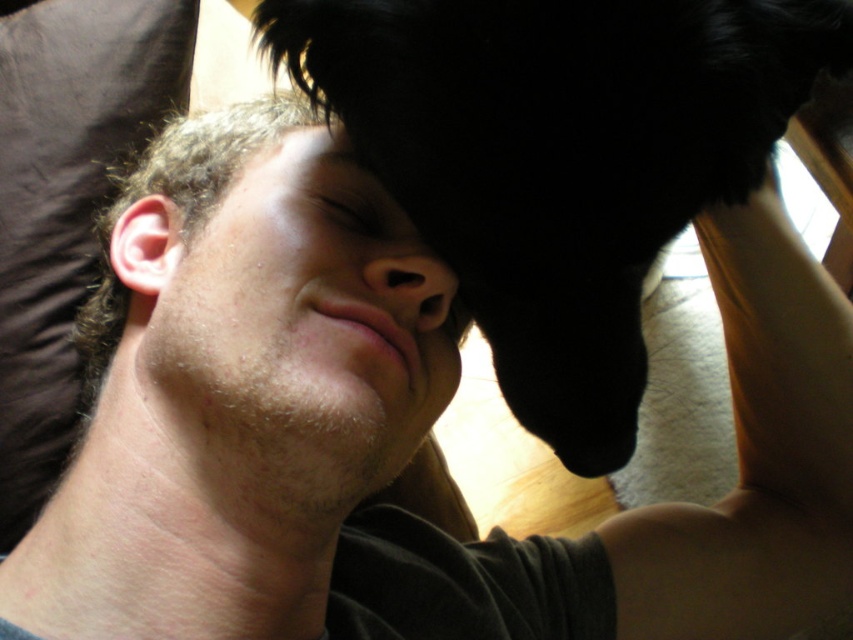
Between black fur at upper center and matte skin nose at center, which one is positioned lower?

matte skin nose at center is lower down.

Which is more to the right, black fur at upper center or matte skin nose at center?

From the viewer's perspective, black fur at upper center appears more on the right side.

Does point (341, 22) come farther from viewer compared to point (410, 260)?

No, it is in front of (410, 260).

Identify the location of black fur at upper center. The height and width of the screenshot is (640, 853). (560, 160).

Is point (693, 8) positioned before point (312, 212)?

Yes, it is in front of point (312, 212).

Find the location of a particular element. The height and width of the screenshot is (640, 853). black fur at upper center is located at coordinates (560, 160).

Where is `black fur at upper center`? The height and width of the screenshot is (640, 853). black fur at upper center is located at coordinates (560, 160).

Can you confirm if smooth skin head at center is shorter than matte skin nose at center?

No, smooth skin head at center is not shorter than matte skin nose at center.

Can you confirm if smooth skin head at center is wider than matte skin nose at center?

Indeed, smooth skin head at center has a greater width compared to matte skin nose at center.

Which is behind, point (329, 227) or point (419, 250)?

Point (419, 250)

At what (x,y) coordinates should I click in order to perform the action: click on smooth skin head at center. Please return your answer as a coordinate pair (x, y). This screenshot has width=853, height=640. Looking at the image, I should click on (180, 205).